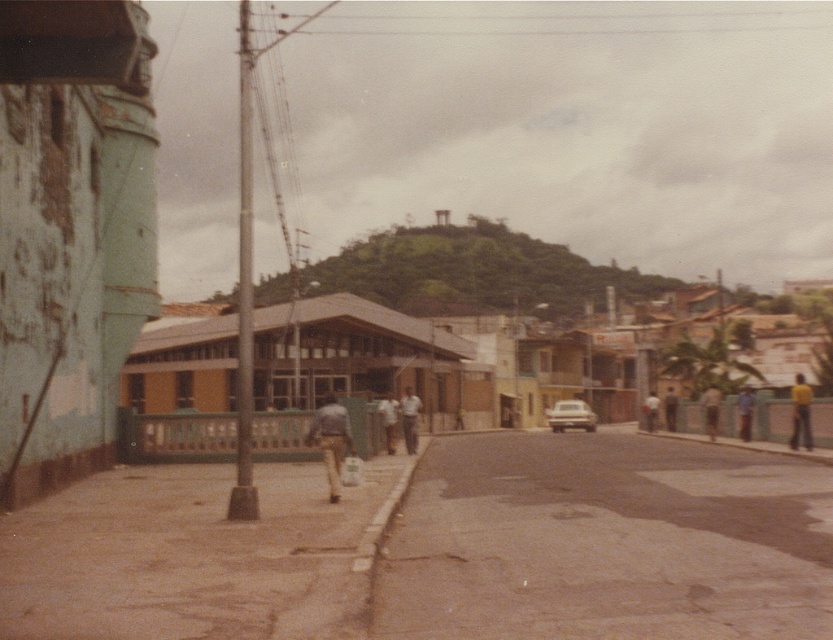
Does point (333, 445) come closer to viewer compared to point (792, 403)?

Yes, it is in front of point (792, 403).

Is light brown leather pants at center bigger than yellow matte shirt at right?

No.

At what (x,y) coordinates should I click in order to perform the action: click on light brown leather pants at center. Please return your answer as a coordinate pair (x, y). Image resolution: width=833 pixels, height=640 pixels. Looking at the image, I should click on (332, 440).

Identify the location of light brown leather pants at center. (332, 440).

Is brown wooden building at center above yellow matte shirt at right?

Correct, brown wooden building at center is located above yellow matte shirt at right.

Who is shorter, brown wooden building at center or yellow matte shirt at right?

With less height is yellow matte shirt at right.

Measure the distance between point (x=307, y=308) and camera.

Point (x=307, y=308) is 156.85 feet from camera.

The width and height of the screenshot is (833, 640). In order to click on brown wooden building at center in this screenshot , I will do `click(445, 362)`.

Is light brown leather jacket at center thinner than brown leather jacket at center?

Correct, light brown leather jacket at center's width is less than brown leather jacket at center's.

Can you confirm if light brown leather jacket at center is wider than brown leather jacket at center?

No, light brown leather jacket at center is not wider than brown leather jacket at center.

Is point (412, 412) less distant than point (707, 426)?

Yes, it is in front of point (707, 426).

Where is `light brown leather jacket at center`? The height and width of the screenshot is (640, 833). light brown leather jacket at center is located at coordinates (408, 419).